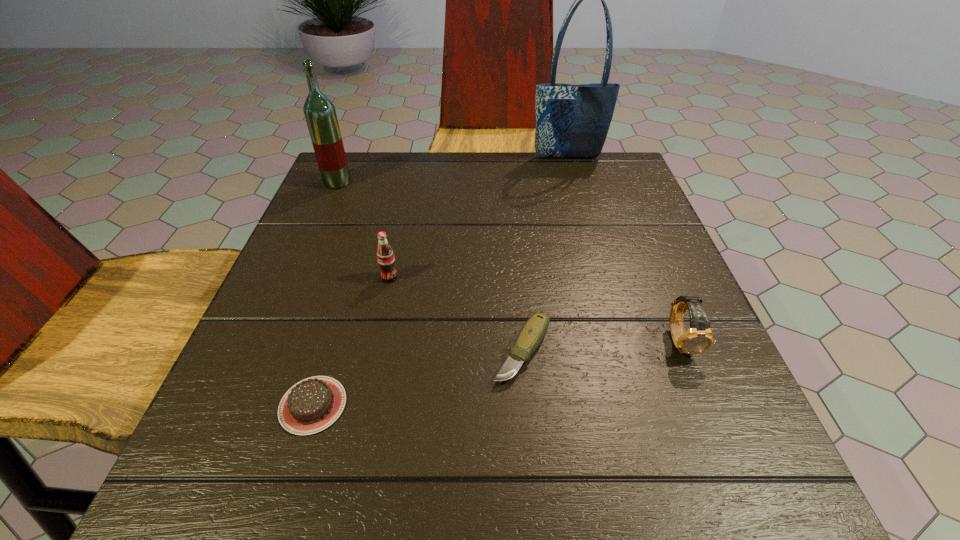
I want to click on the farthest object, so click(x=572, y=121).

Identify the location of the tallest object. (572, 121).

This screenshot has width=960, height=540. I want to click on the second tallest object, so (x=320, y=114).

You are a GUI agent. You are given a task and a screenshot of the screen. Output one action in this format:
    pyautogui.click(x=<x>, y=<y>)
    Task: Click on the leftmost object
    The image size is (960, 540).
    Given the screenshot: What is the action you would take?
    pyautogui.click(x=320, y=114)

Where is `the third farthest object`? the third farthest object is located at coordinates (385, 256).

Where is `soda`? The image size is (960, 540). soda is located at coordinates (385, 256).

Locate an element on the screen. This screenshot has height=540, width=960. watch is located at coordinates (698, 338).

This screenshot has height=540, width=960. What are the coordinates of `pocketknife` in the screenshot? It's located at (533, 331).

At what (x,y) coordinates should I click in order to perform the action: click on the second object from left to right. Please return your answer as a coordinate pair (x, y). Image resolution: width=960 pixels, height=540 pixels. Looking at the image, I should click on pyautogui.click(x=313, y=404).

The image size is (960, 540). What are the coordinates of `free spot located on the front-facing side of the tallest object` in the screenshot? It's located at (588, 226).